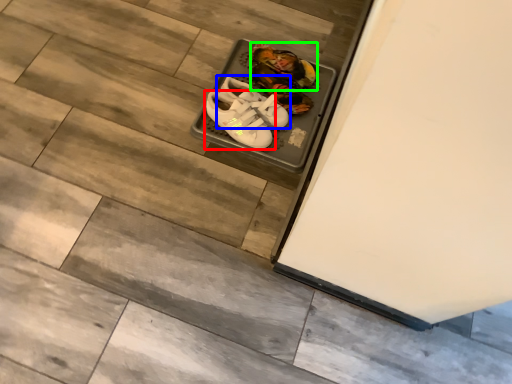
Question: Considering the real-world distances, which object is closest to footwear (highlighted by a red box)? footwear (highlighted by a blue box) or footwear (highlighted by a green box).

Choices:
 (A) footwear
 (B) footwear

Answer: (A)